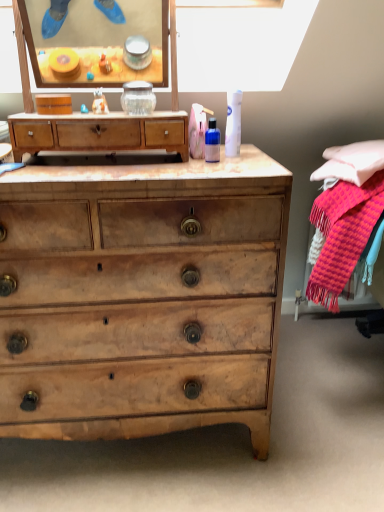
Where is `vacant space that is to the left of translucent plastic bottle at center, positioned as the first toiletry in left-to-right order`? This screenshot has width=384, height=512. vacant space that is to the left of translucent plastic bottle at center, positioned as the first toiletry in left-to-right order is located at coordinates (166, 161).